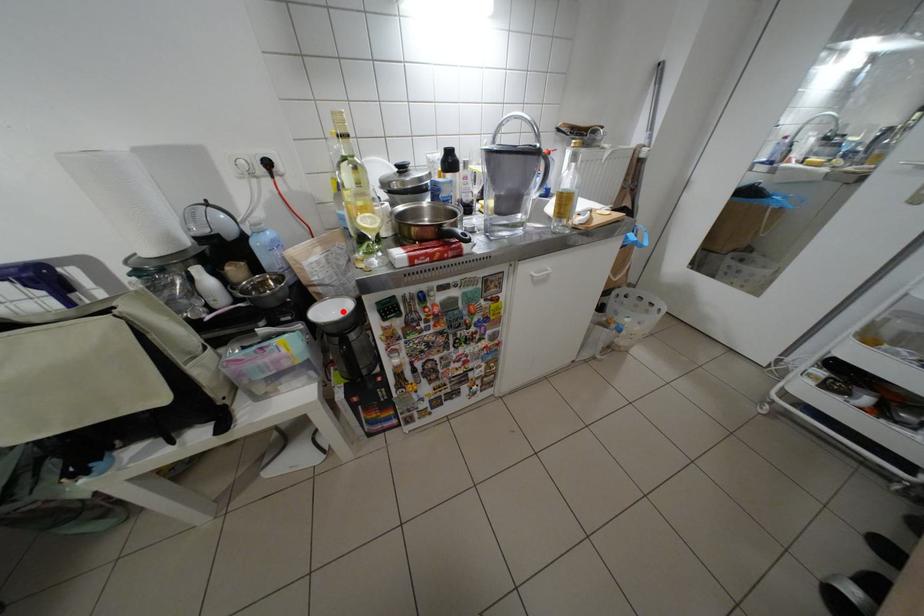
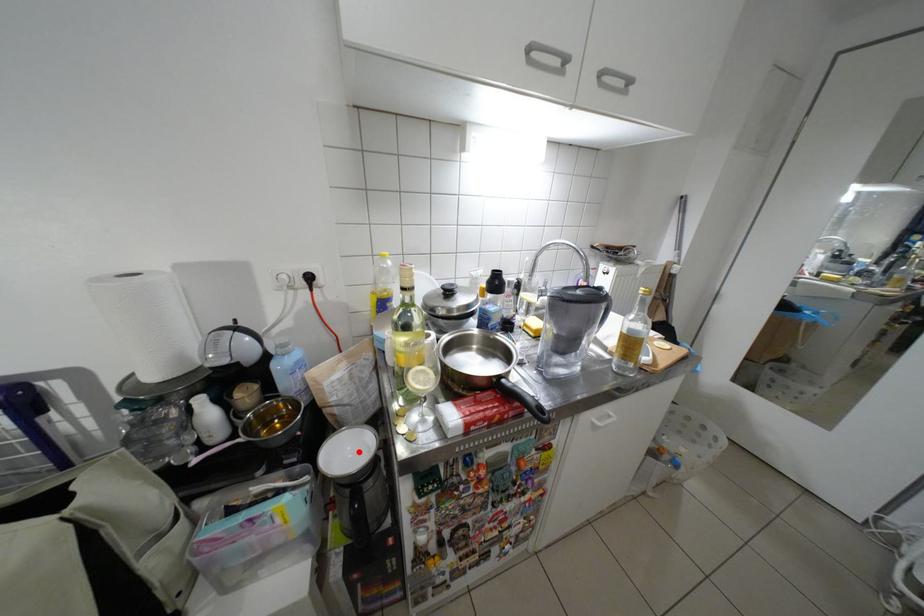
I am providing you with two images of the same scene from different viewpoints. A red point is marked on the first image and another point is marked on the second image. Is the marked point in image1 the same physical position as the marked point in image2?

Yes